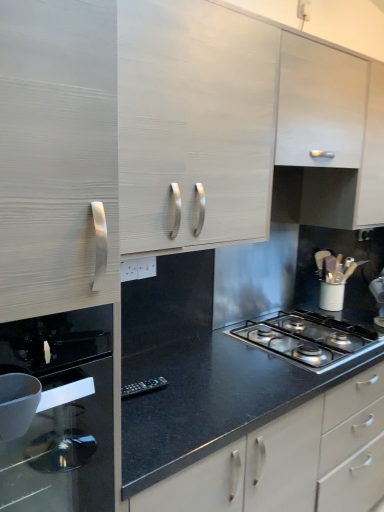
At what (x,y) coordinates should I click in order to perform the action: click on empty space that is to the right of white matte utensil holder at right. Please return your answer as a coordinate pair (x, y). Image resolution: width=384 pixels, height=512 pixels. Looking at the image, I should click on (359, 305).